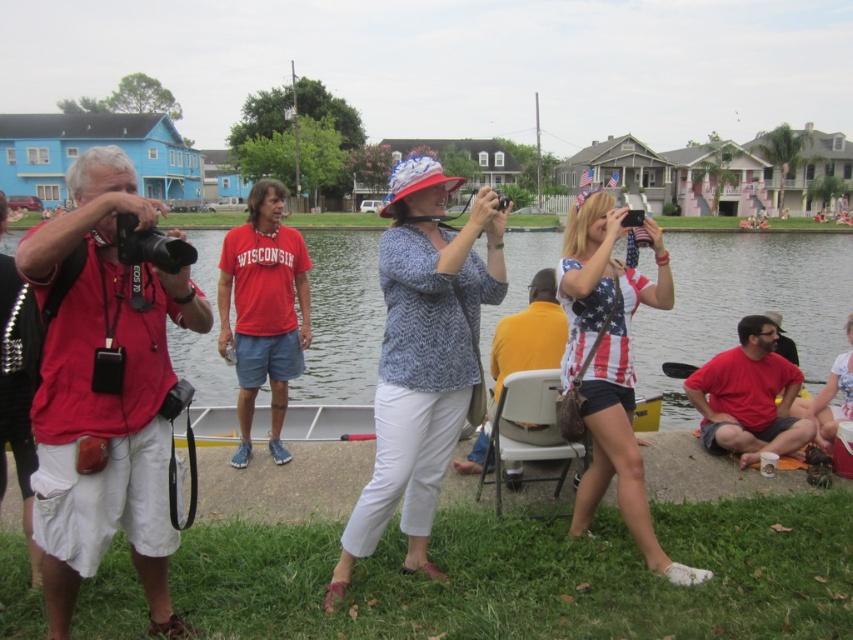
You are a photographer trying to capture a group photo of the two people at the center wearing the american flag fabric tank top at center and the yellow matte shirt at center. Which one should you focus on first if you want to include both in the frame?

You should focus on the yellow matte shirt at center first because the american flag fabric tank top at center is positioned on the right side of it, so adjusting the frame to include both would require starting from the leftmost person.

You are standing at point (422, 259) and want to take a photo of the waterfront scene. The camera you have can focus on subjects within 5 meters. Will the camera be able to focus on the waterfront scene from your current position?

The distance from point (422, 259) to the camera is 5.62 meters. Since the camera can only focus within 5 meters, it will not be able to focus on the waterfront scene from this position.

You are a photographer trying to capture a clear shot of the yellow matte shirt at center and the white plastic chair at center. Which object is shorter in the image?

The yellow matte shirt at center is shorter than the white plastic chair at center.